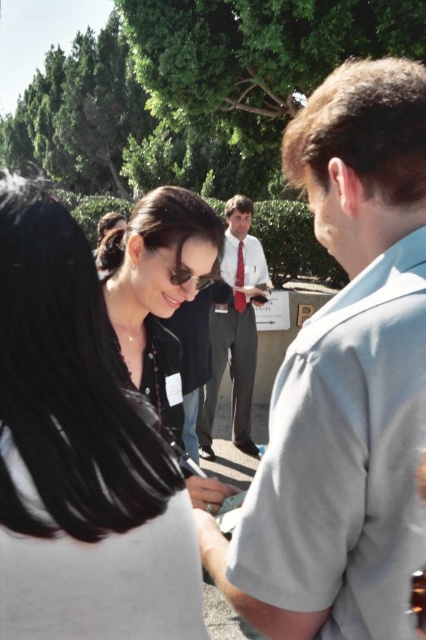
You are organizing a charity event and need to arrange seating based on the attendees clothing. You see a light gray shirt at center and a gray suit at center. Which clothing item should be placed on a smaller chair?

The light gray shirt at center has a smaller size compared to the gray suit at center, so the smaller chair should be assigned to the light gray shirt at center.

You are standing at the edge of the event area and want to hand a brochure to the person wearing the light gray shirt at center and the red satin tie at center. Can you reach both of them with a 5 meter long banner pole?

The light gray shirt at center and the red satin tie at center are 4.44 meters apart. Since the banner pole is 5 meters long, you can reach both individuals as the distance between them is within the pole length.

You are a photographer at the event and want to ensure both the light gray shirt at center and the gray suit at center are clearly visible in your photo. Given their sizes, which one might you need to position closer to the camera to avoid appearing too small?

The light gray shirt at center has a lesser width compared to the gray suit at center, so you should position the light gray shirt at center closer to the camera to ensure it appears adequately sized in the photo.